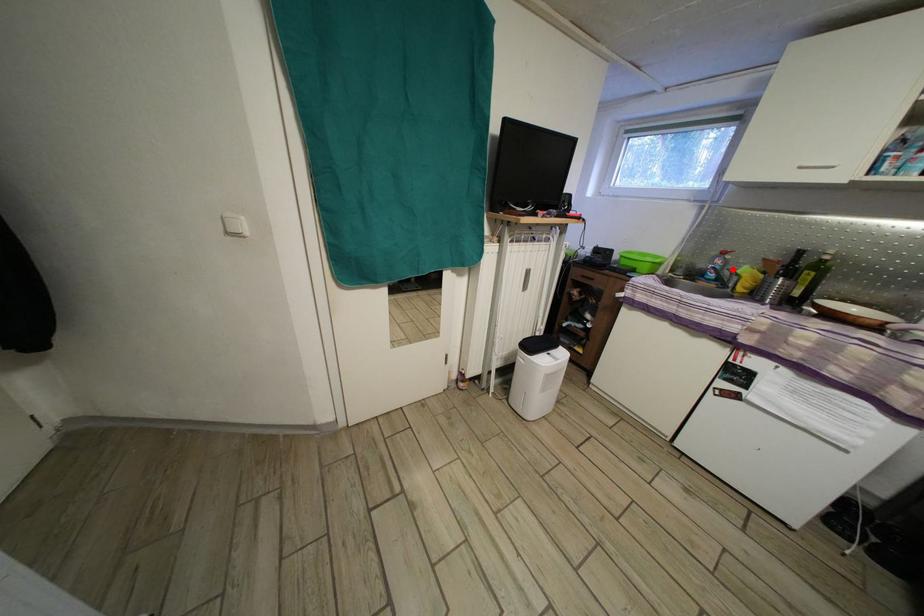
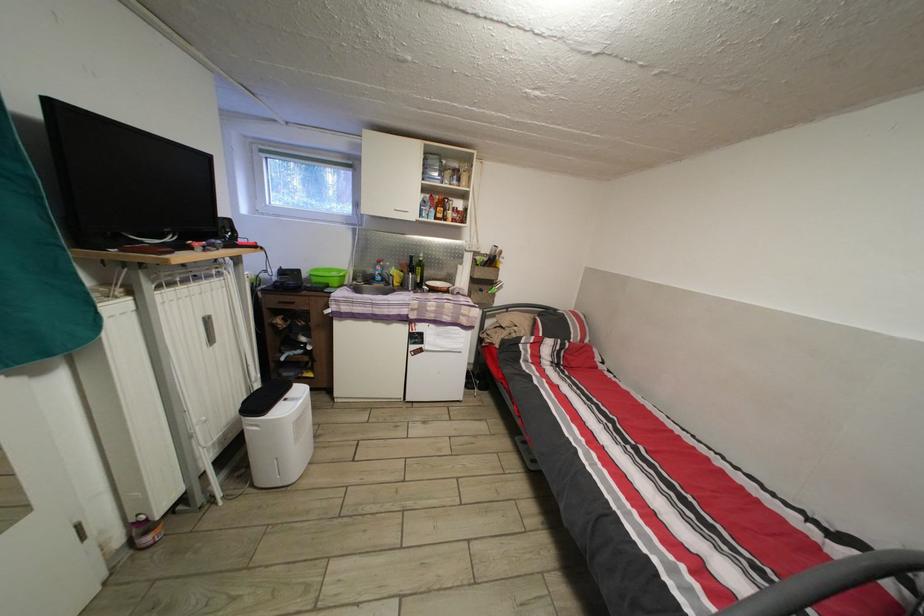
Question: I am providing you with two images of the same scene from different viewpoints. A red point is marked on the first image. Is the red point's position out of view in image 2?

Choices:
 (A) Yes
 (B) No

Answer: (B)